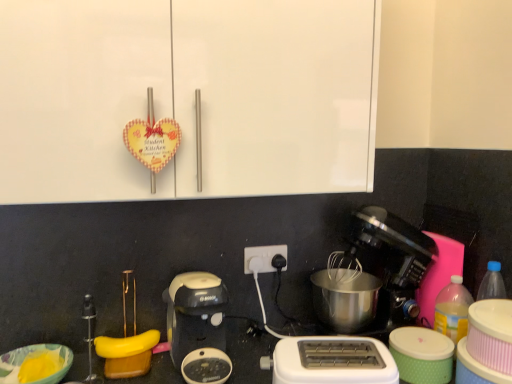
What is the approximate width of matte yellow bowl at lower left?

It is 8.06 inches.

Where is `white plastic toaster at lower center`? white plastic toaster at lower center is located at coordinates (331, 361).

This screenshot has height=384, width=512. Identify the location of green textured container at lower right. (422, 355).

Image resolution: width=512 pixels, height=384 pixels. In order to click on translucent plastic bottle at right in this screenshot , I will do `click(453, 309)`.

The width and height of the screenshot is (512, 384). Describe the element at coordinates (126, 345) in the screenshot. I see `yellow rubber band at lower center` at that location.

In order to click on black plastic power plugs at center in this screenshot , I will do `click(263, 257)`.

The height and width of the screenshot is (384, 512). What are the coordinates of `matte yellow bowl at lower left` in the screenshot? It's located at (35, 364).

From a real-world perspective, is black plastic coffee maker at center right, acting as the 2th coffee maker starting from the left, positioned above or below green textured container at lower right?

In terms of real-world spatial position, black plastic coffee maker at center right, acting as the 2th coffee maker starting from the left, is above green textured container at lower right.

From the image's perspective, relative to green textured container at lower right, is black plastic coffee maker at center right, which appears as the first coffee maker when viewed from the right, above or below?

black plastic coffee maker at center right, which appears as the first coffee maker when viewed from the right, is above green textured container at lower right.

Is black plastic coffee maker at center right, which appears as the first coffee maker when viewed from the right, to the left of green textured container at lower right from the viewer's perspective?

Correct, you'll find black plastic coffee maker at center right, which appears as the first coffee maker when viewed from the right, to the left of green textured container at lower right.

Considering the sizes of objects black plastic coffee maker at center right, acting as the 2th coffee maker starting from the left, and green textured container at lower right in the image provided, who is bigger, black plastic coffee maker at center right, acting as the 2th coffee maker starting from the left, or green textured container at lower right?

black plastic coffee maker at center right, acting as the 2th coffee maker starting from the left, is bigger.

Is translucent plastic bottle at right aimed at yellow rubber band at lower center?

No, translucent plastic bottle at right is not oriented towards yellow rubber band at lower center.

The image size is (512, 384). I want to click on banana below the translucent plastic bottle at right (from a real-world perspective), so click(126, 345).

Can you tell me how much translucent plastic bottle at right and yellow rubber band at lower center differ in facing direction?

They differ by 7.43 degrees in their facing directions.

Considering the sizes of translucent plastic bottle at right and yellow rubber band at lower center in the image, is translucent plastic bottle at right taller or shorter than yellow rubber band at lower center?

Considering their sizes, translucent plastic bottle at right has more height than yellow rubber band at lower center.

Could you tell me if white plastic toaster at lower center is turned towards black plastic coffee maker at center right, acting as the 2th coffee maker starting from the left?

No, white plastic toaster at lower center is not facing towards black plastic coffee maker at center right, acting as the 2th coffee maker starting from the left.

What's the angular difference between white plastic toaster at lower center and black plastic coffee maker at center right, which appears as the first coffee maker when viewed from the right,'s facing directions?

There is a 16.2-degree angle between the facing directions of white plastic toaster at lower center and black plastic coffee maker at center right, which appears as the first coffee maker when viewed from the right.

Is black plastic coffee maker at center right, acting as the 2th coffee maker starting from the left, completely or partially inside white plastic toaster at lower center?

That's incorrect, black plastic coffee maker at center right, acting as the 2th coffee maker starting from the left, is not inside white plastic toaster at lower center.

From the image's perspective, is matte yellow bowl at lower left located above or below black plastic power plugs at center?

matte yellow bowl at lower left is below black plastic power plugs at center.

Is matte yellow bowl at lower left in contact with black plastic power plugs at center?

No, matte yellow bowl at lower left is not next to black plastic power plugs at center.

Which is farther from the camera, (33, 369) or (245, 250)?

The point (245, 250) is more distant.

In order to click on bottle located behind the black plastic coffee maker at lower center, which is counted as the first coffee maker, starting from the left in this screenshot , I will do `click(453, 309)`.

From a real-world perspective, does black plastic coffee maker at lower center, which is counted as the first coffee maker, starting from the left, sit lower than translucent plastic bottle at right?

Incorrect, from a real-world perspective, black plastic coffee maker at lower center, which is counted as the first coffee maker, starting from the left, is higher than translucent plastic bottle at right.

Considering the relative positions of black plastic coffee maker at lower center, the second coffee maker viewed from the right, and translucent plastic bottle at right in the image provided, is black plastic coffee maker at lower center, the second coffee maker viewed from the right, in front of translucent plastic bottle at right?

Yes, black plastic coffee maker at lower center, the second coffee maker viewed from the right, is closer to the camera.

Where is `power plugs and sockets above the translucent plastic bottle at right (from a real-world perspective)`? The width and height of the screenshot is (512, 384). power plugs and sockets above the translucent plastic bottle at right (from a real-world perspective) is located at coordinates (263, 257).

Does black plastic power plugs at center have a greater height compared to translucent plastic bottle at right?

Incorrect, the height of black plastic power plugs at center is not larger of that of translucent plastic bottle at right.

Which is more to the left, black plastic power plugs at center or translucent plastic bottle at right?

black plastic power plugs at center is more to the left.

Looking at the image, does black plastic power plugs at center seem bigger or smaller compared to translucent plastic bottle at right?

black plastic power plugs at center is smaller than translucent plastic bottle at right.

Is green textured container at lower right positioned with its back to black plastic coffee maker at lower center, which is counted as the first coffee maker, starting from the left?

No, green textured container at lower right is not facing the opposite direction of black plastic coffee maker at lower center, which is counted as the first coffee maker, starting from the left.

Relative to black plastic coffee maker at lower center, which is counted as the first coffee maker, starting from the left, is green textured container at lower right in front or behind?

green textured container at lower right is positioned farther from the viewer than black plastic coffee maker at lower center, which is counted as the first coffee maker, starting from the left.

Does green textured container at lower right appear on the right side of black plastic coffee maker at lower center, which is counted as the first coffee maker, starting from the left?

Indeed, green textured container at lower right is positioned on the right side of black plastic coffee maker at lower center, which is counted as the first coffee maker, starting from the left.

Identify the location of the 2nd coffee maker counting from the left side of the green textured container at lower right. Image resolution: width=512 pixels, height=384 pixels. (195, 314).

Identify the location of appliance located below the black plastic coffee maker at center right, which appears as the first coffee maker when viewed from the right (from the image's perspective). This screenshot has height=384, width=512. (422, 355).

Where is `bottle that is above the yellow rubber band at lower center (from the image's perspective)`? bottle that is above the yellow rubber band at lower center (from the image's perspective) is located at coordinates (453, 309).

Estimate the real-world distances between objects in this image. Which object is closer to black plastic coffee maker at lower center, which is counted as the first coffee maker, starting from the left, green textured container at lower right or yellow rubber band at lower center?

yellow rubber band at lower center.

Based on their spatial positions, is matte yellow bowl at lower left or black plastic coffee maker at lower center, the second coffee maker viewed from the right, closer to black plastic power plugs at center?

black plastic coffee maker at lower center, the second coffee maker viewed from the right.

Estimate the real-world distances between objects in this image. Which object is further from matte yellow bowl at lower left, white plastic toaster at lower center or black plastic power plugs at center?

white plastic toaster at lower center is positioned further to the anchor matte yellow bowl at lower left.

From the image, which object appears to be nearer to yellow rubber band at lower center, green textured container at lower right or black plastic coffee maker at lower center, which is counted as the first coffee maker, starting from the left?

Based on the image, black plastic coffee maker at lower center, which is counted as the first coffee maker, starting from the left, appears to be nearer to yellow rubber band at lower center.

Looking at the image, which one is located closer to matte yellow bowl at lower left, black plastic power plugs at center or black plastic coffee maker at center right, which appears as the first coffee maker when viewed from the right?

The object closer to matte yellow bowl at lower left is black plastic power plugs at center.

Estimate the real-world distances between objects in this image. Which object is further from black plastic coffee maker at center right, which appears as the first coffee maker when viewed from the right, black plastic coffee maker at lower center, which is counted as the first coffee maker, starting from the left, or black plastic power plugs at center?

black plastic coffee maker at lower center, which is counted as the first coffee maker, starting from the left, is further to black plastic coffee maker at center right, which appears as the first coffee maker when viewed from the right.

Considering their positions, is black plastic coffee maker at lower center, the second coffee maker viewed from the right, positioned further to yellow rubber band at lower center than green textured container at lower right?

green textured container at lower right is further to yellow rubber band at lower center.

Based on their spatial positions, is white plastic toaster at lower center or green textured container at lower right further from black plastic coffee maker at center right, which appears as the first coffee maker when viewed from the right?

white plastic toaster at lower center is further to black plastic coffee maker at center right, which appears as the first coffee maker when viewed from the right.

Identify the location of coffee maker situated between black plastic coffee maker at lower center, which is counted as the first coffee maker, starting from the left, and translucent plastic bottle at right from left to right. (383, 266).

Where is `toaster between matte yellow bowl at lower left and green textured container at lower right from left to right`? toaster between matte yellow bowl at lower left and green textured container at lower right from left to right is located at coordinates (331, 361).

At what (x,y) coordinates should I click in order to perform the action: click on appliance situated between black plastic coffee maker at lower center, the second coffee maker viewed from the right, and translucent plastic bottle at right from left to right. Please return your answer as a coordinate pair (x, y). This screenshot has height=384, width=512. Looking at the image, I should click on pos(422,355).

Identify the location of power plugs and sockets located between black plastic coffee maker at lower center, the second coffee maker viewed from the right, and translucent plastic bottle at right in the left-right direction. The image size is (512, 384). (263, 257).